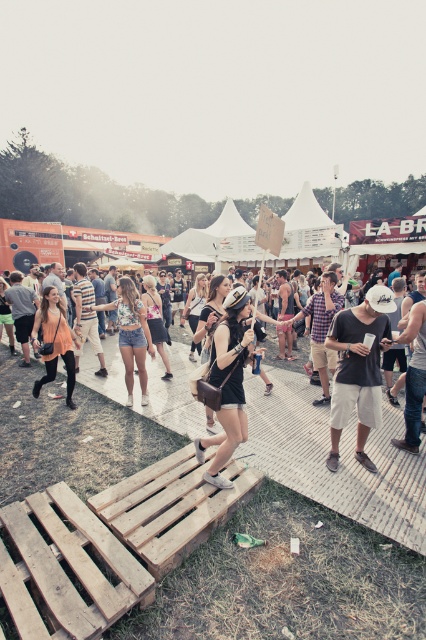
Question: Which point is closer to the camera?

Choices:
 (A) (336, 396)
 (B) (224, 448)

Answer: (B)

Question: Is dark gray cotton t-shirt at center smaller than black matte shorts at center?

Choices:
 (A) yes
 (B) no

Answer: (B)

Question: Which of the following is the farthest from the observer?

Choices:
 (A) (x=351, y=406)
 (B) (x=216, y=410)

Answer: (A)

Question: Is dark gray cotton t-shirt at center positioned at the back of black matte shorts at center?

Choices:
 (A) no
 (B) yes

Answer: (B)

Question: Among these points, which one is nearest to the camera?

Choices:
 (A) (233, 442)
 (B) (370, 321)

Answer: (A)

Question: Can you confirm if dark gray cotton t-shirt at center is smaller than black matte shorts at center?

Choices:
 (A) yes
 (B) no

Answer: (B)